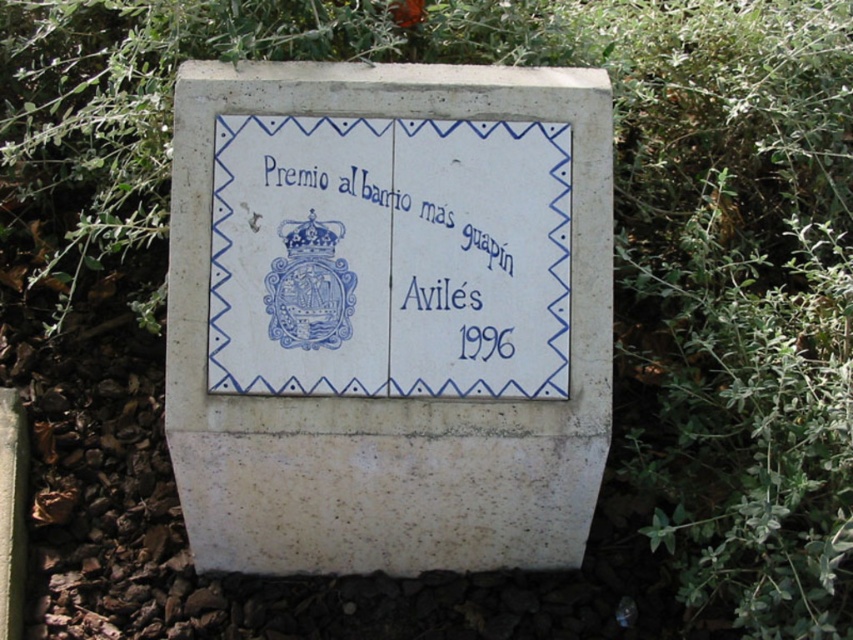
You are a tourist visiting Avil 1996. You see the white stone plaque at center and the blue ceramic tile at center. Which object is located below the other?

The white stone plaque at center is positioned under the blue ceramic tile at center, so the white stone plaque at center is below the blue ceramic tile at center.

You are standing in front of the commemorative plaque and want to touch both points mentioned. Which point should you reach for first, the point at coordinates point (555,120) or point (282,310)?

You should reach for point (555,120) first because it is closer to you than point (282,310).

You are a tourist visiting the monument and want to take a photo of both the white stone plaque at center and the blue ceramic tile at center. Which object should you focus on first to ensure both are in frame?

The white stone plaque at center is much taller than the blue ceramic tile at center, so you should focus on the white stone plaque at center first to ensure both are in frame.